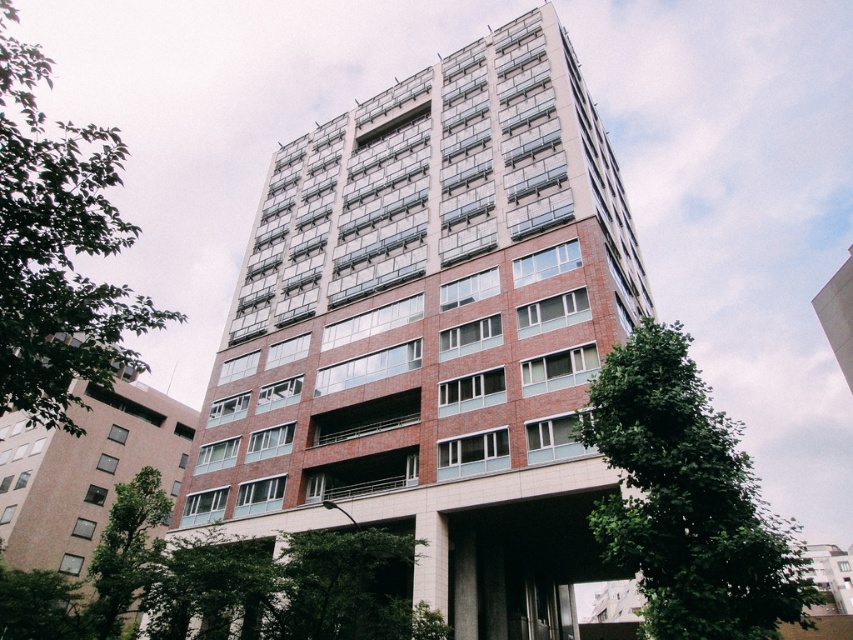
Between green leafy tree at lower right and green leafy tree at lower center, which one has less height?

Standing shorter between the two is green leafy tree at lower center.

Can you confirm if green leafy tree at lower right is shorter than green leafy tree at lower center?

In fact, green leafy tree at lower right may be taller than green leafy tree at lower center.

Between point (708, 492) and point (410, 612), which one is positioned in front?

Positioned in front is point (708, 492).

Find the location of a particular element. The width and height of the screenshot is (853, 640). green leafy tree at lower right is located at coordinates (686, 499).

Does green leafy tree at lower right lie in front of green leafy tree at left?

No, green leafy tree at lower right is further to the viewer.

Is point (636, 531) farther from viewer compared to point (68, 168)?

Yes, it is behind point (68, 168).

Where is `green leafy tree at lower right`? The image size is (853, 640). green leafy tree at lower right is located at coordinates (686, 499).

Between green leafy tree at lower center and green leafy tree at lower left, which one appears on the left side from the viewer's perspective?

Positioned to the left is green leafy tree at lower left.

Does green leafy tree at lower center have a smaller size compared to green leafy tree at lower left?

Indeed, green leafy tree at lower center has a smaller size compared to green leafy tree at lower left.

What are the coordinates of `green leafy tree at lower center` in the screenshot? It's located at click(346, 588).